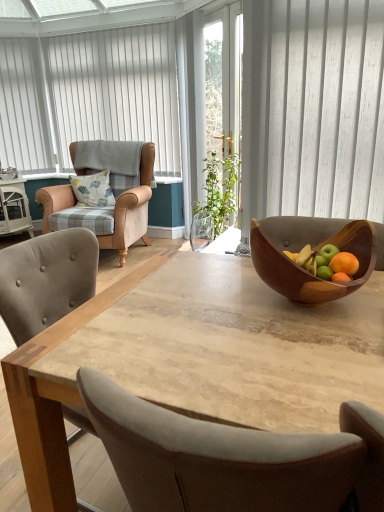
Identify the location of vacant region in front of wooden bowl at center. (308, 353).